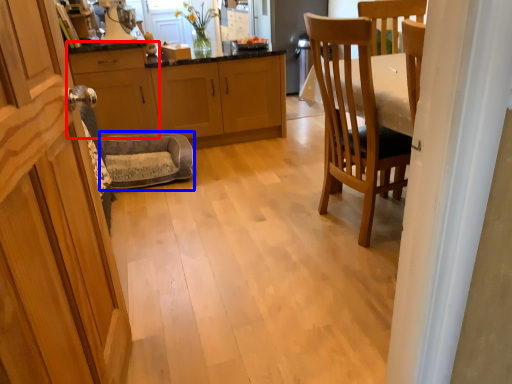
Question: Which of the following is the farthest to the observer, cabinetry (highlighted by a red box) or rocking chair (highlighted by a blue box)?

Choices:
 (A) cabinetry
 (B) rocking chair

Answer: (A)